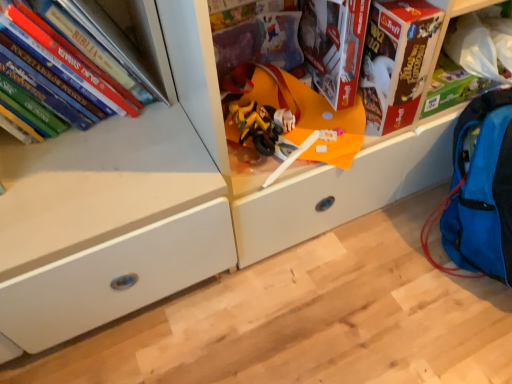
This screenshot has height=384, width=512. Describe the element at coordinates (396, 61) in the screenshot. I see `red cardboard box at upper right` at that location.

You are a GUI agent. You are given a task and a screenshot of the screen. Output one action in this format:
    pyautogui.click(x=<x>, y=<y>)
    Task: Click on the cardboard box at upper right, which is the 1th shelf from back to front
    The width and height of the screenshot is (512, 384).
    Given the screenshot: What is the action you would take?
    pyautogui.click(x=481, y=44)

Identify the location of yellow matte motorcycle at center. (289, 118).

Where is `white matte drawer at center, marked as the 1th shelf in a front-to-back arrangement`? Image resolution: width=512 pixels, height=384 pixels. white matte drawer at center, marked as the 1th shelf in a front-to-back arrangement is located at coordinates (247, 175).

At what (x,y) coordinates should I click in order to perform the action: click on red cardboard box at upper right. Please return your answer as a coordinate pair (x, y). Looking at the image, I should click on (396, 61).

From the image's perspective, is red cardboard box at upper right located beneath blue fabric backpack at lower right?

No.

Based on the photo, does red cardboard box at upper right have a smaller size compared to blue fabric backpack at lower right?

Yes.

Measure the distance between red cardboard box at upper right and blue fabric backpack at lower right.

They are 9.40 inches apart.

From a real-world perspective, between red cardboard box at upper right and blue fabric backpack at lower right, who is vertically lower?

blue fabric backpack at lower right, from a real-world perspective.

Is yellow matte motorcycle at center oriented away from blue fabric backpack at lower right?

yellow matte motorcycle at center does not have its back to blue fabric backpack at lower right.

Considering the sizes of objects yellow matte motorcycle at center and blue fabric backpack at lower right in the image provided, who is smaller, yellow matte motorcycle at center or blue fabric backpack at lower right?

yellow matte motorcycle at center.

Considering the points (356, 103) and (495, 156), which point is in front, point (356, 103) or point (495, 156)?

Point (495, 156)

Is yellow matte motorcycle at center not inside blue fabric backpack at lower right?

yellow matte motorcycle at center lies outside blue fabric backpack at lower right's area.

Which of these two, yellow matte motorcycle at center or hardcover books at left, is smaller?

yellow matte motorcycle at center.

Measure the distance between yellow matte motorcycle at center and hardcover books at left.

yellow matte motorcycle at center and hardcover books at left are 12.57 inches apart from each other.

Is point (316, 109) less distant than point (80, 70)?

No, it is behind (80, 70).

Is yellow matte motorcycle at center far away from hardcover books at left?

No, yellow matte motorcycle at center is not far away from hardcover books at left.

Which object is closer to the camera taking this photo, white matte drawer at center, marked as the 1th shelf in a front-to-back arrangement, or red cardboard box at upper right?

Positioned in front is white matte drawer at center, marked as the 1th shelf in a front-to-back arrangement.

In the scene shown: Would you say white matte drawer at center, marked as the 1th shelf in a front-to-back arrangement, is inside or outside red cardboard box at upper right?

white matte drawer at center, marked as the 1th shelf in a front-to-back arrangement, is spatially situated outside red cardboard box at upper right.

Which is in front, point (395, 162) or point (433, 34)?

The point (433, 34) is in front.

Which of these two, white matte drawer at center, marked as the 1th shelf in a front-to-back arrangement, or red cardboard box at upper right, stands taller?

white matte drawer at center, marked as the 1th shelf in a front-to-back arrangement, is taller.

Can you confirm if cardboard box at upper right, the 2th shelf positioned from the front, is wider than blue fabric backpack at lower right?

No.

How many degrees apart are the facing directions of cardboard box at upper right, which is the 1th shelf from back to front, and blue fabric backpack at lower right?

There is a 1.08-degree angle between the facing directions of cardboard box at upper right, which is the 1th shelf from back to front, and blue fabric backpack at lower right.

From a real-world perspective, is cardboard box at upper right, which is the 1th shelf from back to front, physically above blue fabric backpack at lower right?

Yes, from a real-world perspective, cardboard box at upper right, which is the 1th shelf from back to front, is over blue fabric backpack at lower right

Is point (489, 226) more distant than point (419, 89)?

That is True.

Where is `paperback book on the left of the blue fabric backpack at lower right`? The height and width of the screenshot is (384, 512). paperback book on the left of the blue fabric backpack at lower right is located at coordinates (396, 61).

In the scene shown: From the image's perspective, is blue fabric backpack at lower right located above or below red cardboard box at upper right?

blue fabric backpack at lower right is below red cardboard box at upper right.

From their relative heights in the image, would you say white matte drawer at center, which is the second shelf in back-to-front order, is taller or shorter than blue fabric backpack at lower right?

In the image, white matte drawer at center, which is the second shelf in back-to-front order, appears to be taller than blue fabric backpack at lower right.

Considering the sizes of objects white matte drawer at center, marked as the 1th shelf in a front-to-back arrangement, and blue fabric backpack at lower right in the image provided, who is wider, white matte drawer at center, marked as the 1th shelf in a front-to-back arrangement, or blue fabric backpack at lower right?

white matte drawer at center, marked as the 1th shelf in a front-to-back arrangement.

Between point (366, 138) and point (495, 190), which one is positioned in front?

Positioned in front is point (495, 190).

From a real-world perspective, between white matte drawer at center, marked as the 1th shelf in a front-to-back arrangement, and blue fabric backpack at lower right, who is vertically higher?

white matte drawer at center, marked as the 1th shelf in a front-to-back arrangement.

Identify the location of paperback book on the left of blue fabric backpack at lower right. (396, 61).

The height and width of the screenshot is (384, 512). I want to click on toy behind the blue fabric backpack at lower right, so click(x=289, y=118).

Estimate the real-world distances between objects in this image. Which object is closer to cardboard box at upper right, which is the 1th shelf from back to front, yellow matte motorcycle at center or white matte drawer at center, which is the second shelf in back-to-front order?

white matte drawer at center, which is the second shelf in back-to-front order, is positioned closer to the anchor cardboard box at upper right, which is the 1th shelf from back to front.

Looking at this image, estimate the real-world distances between objects in this image. Which object is closer to cardboard box at upper right, which is the 1th shelf from back to front, blue fabric backpack at lower right or red cardboard box at upper right?

red cardboard box at upper right.

When comparing their distances from white matte drawer at center, which is the second shelf in back-to-front order, does red cardboard box at upper right or cardboard box at upper right, the 2th shelf positioned from the front, seem closer?

red cardboard box at upper right is positioned closer to the anchor white matte drawer at center, which is the second shelf in back-to-front order.

Looking at the image, which one is located closer to cardboard box at upper right, which is the 1th shelf from back to front, hardcover books at left or red cardboard box at upper right?

red cardboard box at upper right is positioned closer to the anchor cardboard box at upper right, which is the 1th shelf from back to front.

Based on their spatial positions, is red cardboard box at upper right or hardcover books at left further from yellow matte motorcycle at center?

Based on the image, hardcover books at left appears to be further to yellow matte motorcycle at center.

Looking at the image, which one is located closer to red cardboard box at upper right, blue fabric backpack at lower right or yellow matte motorcycle at center?

yellow matte motorcycle at center is positioned closer to the anchor red cardboard box at upper right.

Looking at this image, from the image, which object appears to be nearer to white matte drawer at center, which is the second shelf in back-to-front order, cardboard box at upper right, which is the 1th shelf from back to front, or blue fabric backpack at lower right?

The object closer to white matte drawer at center, which is the second shelf in back-to-front order, is cardboard box at upper right, which is the 1th shelf from back to front.

Estimate the real-world distances between objects in this image. Which object is closer to red cardboard box at upper right, hardcover books at left or cardboard box at upper right, the 2th shelf positioned from the front?

cardboard box at upper right, the 2th shelf positioned from the front, is positioned closer to the anchor red cardboard box at upper right.

You are a GUI agent. You are given a task and a screenshot of the screen. Output one action in this format:
    pyautogui.click(x=<x>, y=<y>)
    Task: Click on the paperback book located between white matte drawer at center, marked as the 1th shelf in a front-to-back arrangement, and cardboard box at upper right, which is the 1th shelf from back to front, in the depth direction
    This screenshot has width=512, height=384.
    Given the screenshot: What is the action you would take?
    pyautogui.click(x=396, y=61)

Identify the location of shelf between yellow matte motorcycle at center and red cardboard box at upper right. (247, 175).

Image resolution: width=512 pixels, height=384 pixels. I want to click on toy between hardcover books at left and blue fabric backpack at lower right from left to right, so click(x=289, y=118).

The width and height of the screenshot is (512, 384). I want to click on paperback book between white matte drawer at center, which is the second shelf in back-to-front order, and blue fabric backpack at lower right, in the horizontal direction, so click(396, 61).